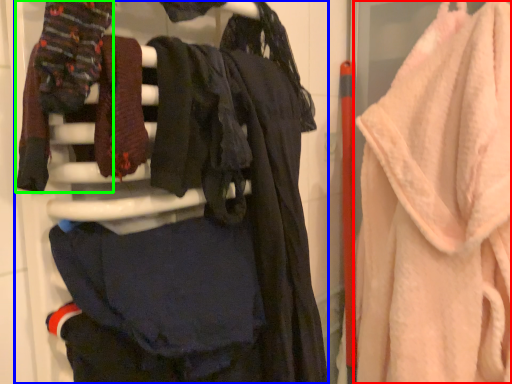
Question: Considering the real-world distances, which object is closest to towel (highlighted by a red box)? closet (highlighted by a blue box) or clothing (highlighted by a green box).

Choices:
 (A) closet
 (B) clothing

Answer: (A)